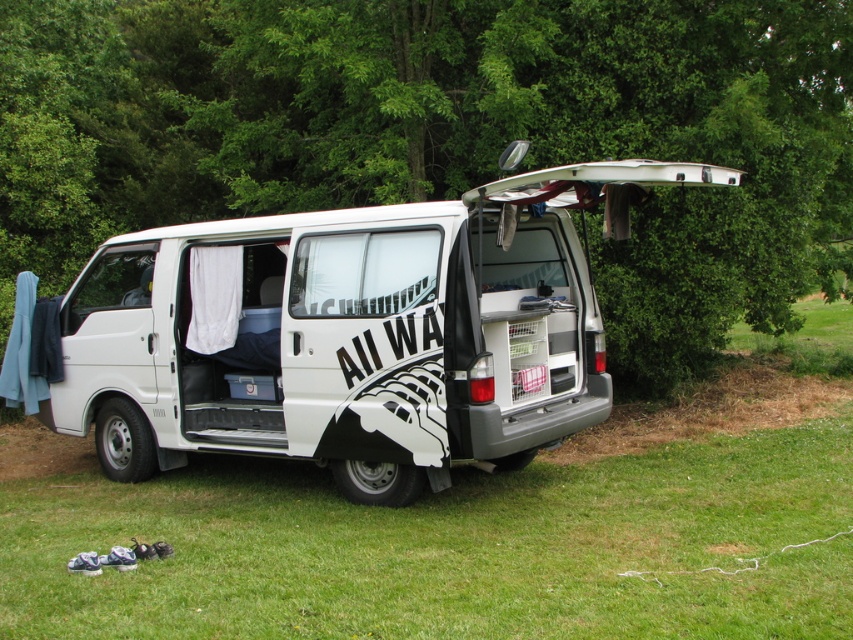
Question: Can you confirm if green leafy tree at upper center is positioned to the right of white matte van at center?

Choices:
 (A) yes
 (B) no

Answer: (B)

Question: Where is green leafy tree at upper center located in relation to white matte van at center in the image?

Choices:
 (A) right
 (B) left

Answer: (B)

Question: Is green leafy tree at upper center to the left of white matte van at center from the viewer's perspective?

Choices:
 (A) yes
 (B) no

Answer: (A)

Question: Among these points, which one is nearest to the camera?

Choices:
 (A) (184, 131)
 (B) (328, 429)

Answer: (B)